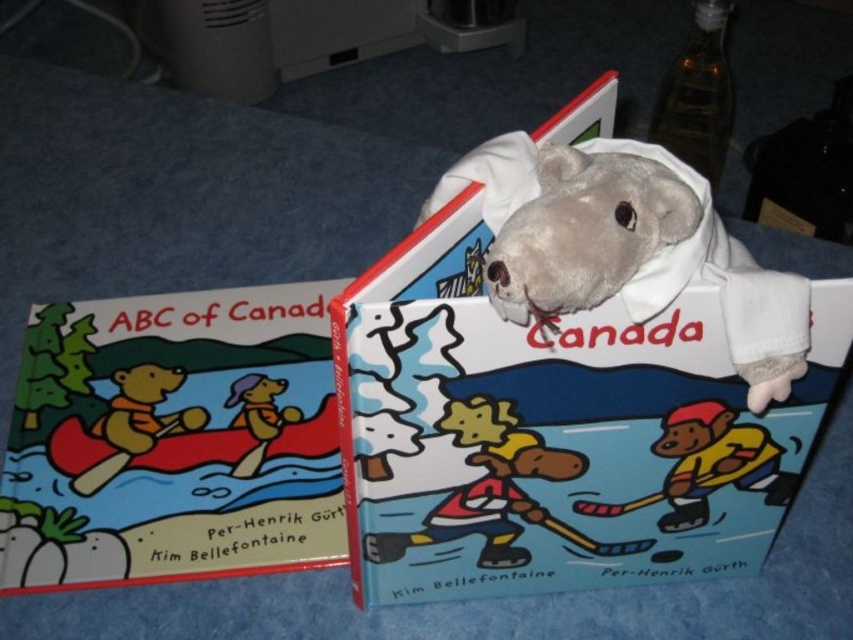
You are a child who wants to place a new toy between the gray plush toy at center and the brown plush bear at left. The toy is 10 inches long. Can it fit between them?

The gray plush toy at center and brown plush bear at left are 21.88 inches apart. Since the new toy is only 10 inches long, it can fit between them with space to spare.

You are a child who wants to give both the gray plush toy at center and the brown plush bear at left to your younger sibling. However, you have a small backpack that can only carry one of them. Based on their sizes, which one should you choose to fit better?

The gray plush toy at center is larger in size than the brown plush bear at left, so the brown plush bear at left will fit better in the small backpack.